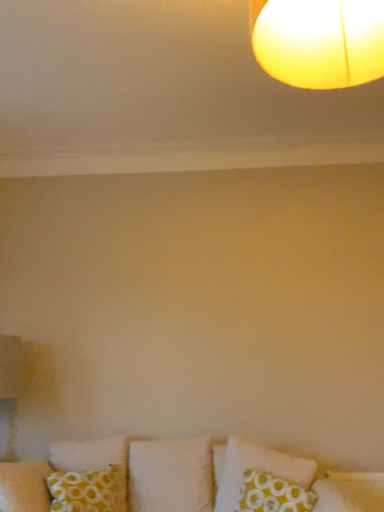
Identify the location of green dotted pillow at lower center. (264, 480).

This screenshot has width=384, height=512. What do you see at coordinates (264, 480) in the screenshot? I see `green dotted pillow at lower center` at bounding box center [264, 480].

What is the approximate height of green dotted pillow at lower center?

It is 18.24 inches.

Where is `green dotted pillow at lower center`? The image size is (384, 512). green dotted pillow at lower center is located at coordinates (264, 480).